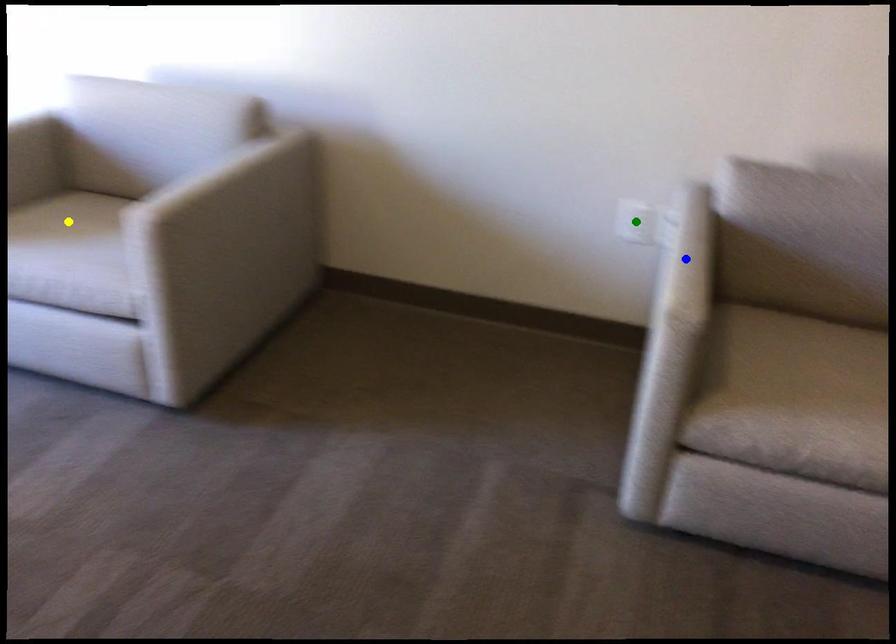
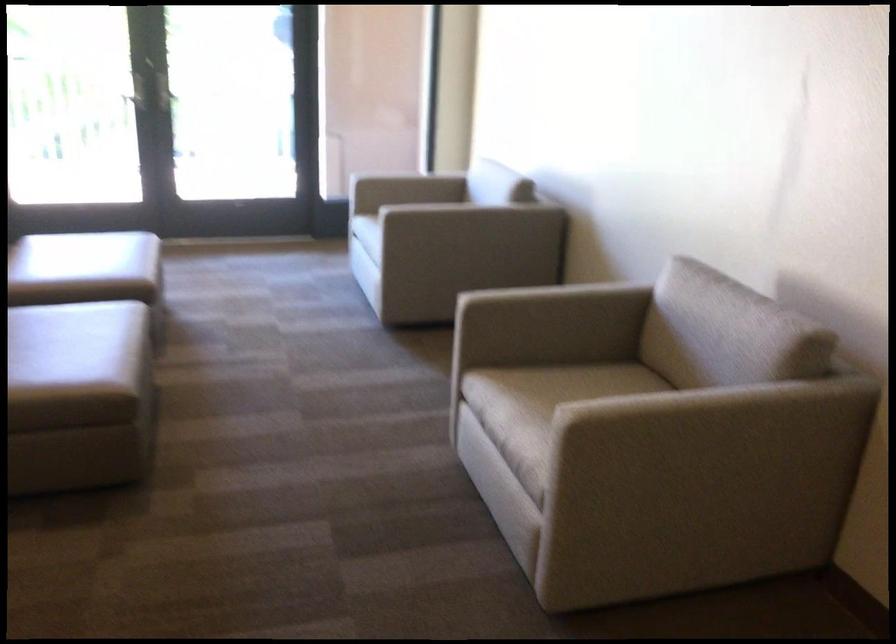
I am providing you with two images of the same scene from different viewpoints. Three points are marked in image1. Which point corresponds to a part or object that is occluded in image2?In image1, three points are marked. Which of them correspond to a part or object that is occluded in image2?Among the three points shown in image1, which one corresponds to a part or object that is no longer visible due to occlusion in image2?

Invisible in image2: yellow point, green point.